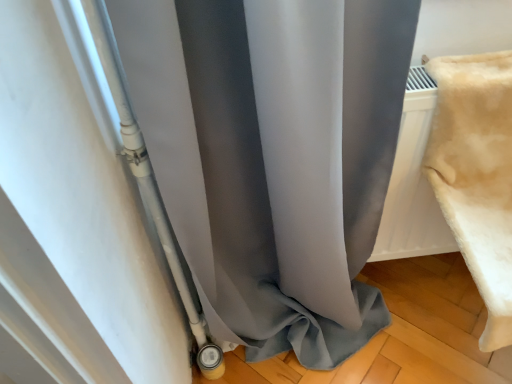
At what (x,y) coordinates should I click in order to perform the action: click on beige plush blanket at right. Please return your answer as a coordinate pair (x, y). Image resolution: width=512 pixels, height=384 pixels. Looking at the image, I should click on (477, 175).

Describe the element at coordinates (477, 175) in the screenshot. I see `beige plush blanket at right` at that location.

Describe the element at coordinates (273, 156) in the screenshot. The width and height of the screenshot is (512, 384). I see `matte gray curtain at center` at that location.

The width and height of the screenshot is (512, 384). I want to click on matte gray curtain at center, so click(273, 156).

This screenshot has width=512, height=384. I want to click on beige plush blanket at right, so click(477, 175).

Is matte gray curtain at center to the right of beige plush blanket at right from the viewer's perspective?

No, matte gray curtain at center is not to the right of beige plush blanket at right.

Considering the relative positions of matte gray curtain at center and beige plush blanket at right in the image provided, is matte gray curtain at center in front of beige plush blanket at right?

Yes, matte gray curtain at center is in front of beige plush blanket at right.

Does point (204, 22) lie in front of point (492, 283)?

Yes, point (204, 22) is in front of point (492, 283).

From the image's perspective, between matte gray curtain at center and beige plush blanket at right, which one is located above?

beige plush blanket at right is shown above in the image.

Consider the image. From a real-world perspective, who is located lower, matte gray curtain at center or beige plush blanket at right?

From a 3D spatial view, matte gray curtain at center is below.

Considering the relative sizes of matte gray curtain at center and beige plush blanket at right in the image provided, is matte gray curtain at center thinner than beige plush blanket at right?

Yes.

Can you confirm if matte gray curtain at center is taller than beige plush blanket at right?

Correct, matte gray curtain at center is much taller as beige plush blanket at right.

Can you confirm if matte gray curtain at center is bigger than beige plush blanket at right?

Correct, matte gray curtain at center is larger in size than beige plush blanket at right.

Is matte gray curtain at center inside or outside of beige plush blanket at right?

The correct answer is: outside.

Are matte gray curtain at center and beige plush blanket at right located far from each other?

No, matte gray curtain at center is in close proximity to beige plush blanket at right.

Is matte gray curtain at center oriented towards beige plush blanket at right?

A: No, matte gray curtain at center is not oriented towards beige plush blanket at right.

Can you tell me how much matte gray curtain at center and beige plush blanket at right differ in facing direction?

The angle between the facing direction of matte gray curtain at center and the facing direction of beige plush blanket at right is 0.645 degrees.

Identify the location of material on the right of matte gray curtain at center. (477, 175).

Is beige plush blanket at right to the right of matte gray curtain at center from the viewer's perspective?

Yes, beige plush blanket at right is to the right of matte gray curtain at center.

Which object is further away from the camera taking this photo, beige plush blanket at right or matte gray curtain at center?

beige plush blanket at right is behind.

Does point (475, 203) lie behind point (396, 20)?

That is True.

From the image's perspective, which is above, beige plush blanket at right or matte gray curtain at center?

beige plush blanket at right.

From a real-world perspective, is beige plush blanket at right below matte gray curtain at center?

No.

Considering the sizes of objects beige plush blanket at right and matte gray curtain at center in the image provided, who is thinner, beige plush blanket at right or matte gray curtain at center?

Thinner between the two is matte gray curtain at center.

Which of these two, beige plush blanket at right or matte gray curtain at center, stands shorter?

With less height is beige plush blanket at right.

Is beige plush blanket at right bigger or smaller than matte gray curtain at center?

In the image, beige plush blanket at right appears to be smaller than matte gray curtain at center.

Do you think beige plush blanket at right is within matte gray curtain at center, or outside of it?

beige plush blanket at right exists outside the volume of matte gray curtain at center.

Is beige plush blanket at right in contact with matte gray curtain at center?

beige plush blanket at right and matte gray curtain at center are clearly separated.

Does beige plush blanket at right turn towards matte gray curtain at center?

No, beige plush blanket at right is not aimed at matte gray curtain at center.

The width and height of the screenshot is (512, 384). Identify the location of curtain below the beige plush blanket at right (from a real-world perspective). (273, 156).

You are a GUI agent. You are given a task and a screenshot of the screen. Output one action in this format:
    pyautogui.click(x=<x>, y=<y>)
    Task: Click on the material that is behind the matte gray curtain at center
    The image size is (512, 384).
    Given the screenshot: What is the action you would take?
    pyautogui.click(x=477, y=175)

At what (x,y) coordinates should I click in order to perform the action: click on curtain directly beneath the beige plush blanket at right (from a real-world perspective). Please return your answer as a coordinate pair (x, y). Looking at the image, I should click on (273, 156).